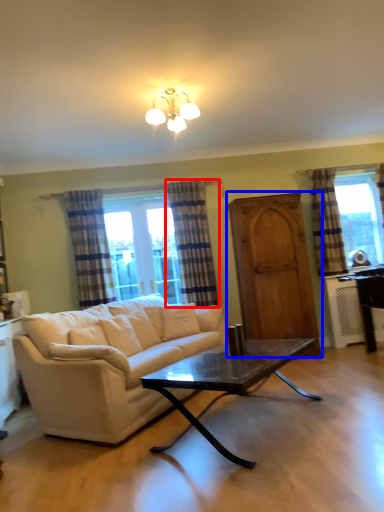
Question: Which of the following is the farthest to the observer, curtain (highlighted by a red box) or screen door (highlighted by a blue box)?

Choices:
 (A) curtain
 (B) screen door

Answer: (A)